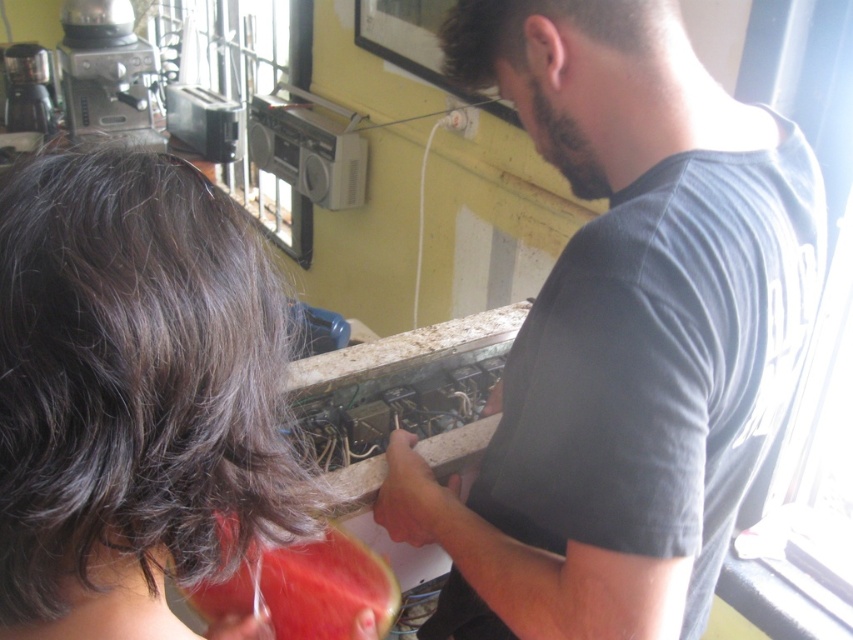
Between gray matte shirt at center and red matte watermelon at lower left, which one appears on the right side from the viewer's perspective?

Positioned to the right is gray matte shirt at center.

Between gray matte shirt at center and red matte watermelon at lower left, which one has more height?

Standing taller between the two is gray matte shirt at center.

Is point (613, 182) closer to camera compared to point (369, 580)?

Yes.

Find the location of `gray matte shirt at center`. gray matte shirt at center is located at coordinates (624, 333).

Does dark brown hair at upper left appear under red matte watermelon at lower left?

Actually, dark brown hair at upper left is above red matte watermelon at lower left.

Can you confirm if dark brown hair at upper left is shorter than red matte watermelon at lower left?

Yes, dark brown hair at upper left is shorter than red matte watermelon at lower left.

Between point (36, 221) and point (294, 563), which one is positioned behind?

The point (294, 563) is behind.

Find the location of a particular element. dark brown hair at upper left is located at coordinates (132, 394).

Which is more to the left, gray matte shirt at center or dark brown hair at upper left?

Positioned to the left is dark brown hair at upper left.

Which is above, gray matte shirt at center or dark brown hair at upper left?

gray matte shirt at center is above.

Is point (712, 340) closer to viewer compared to point (277, 355)?

No, it is behind (277, 355).

Find the location of a particular element. The image size is (853, 640). gray matte shirt at center is located at coordinates (624, 333).